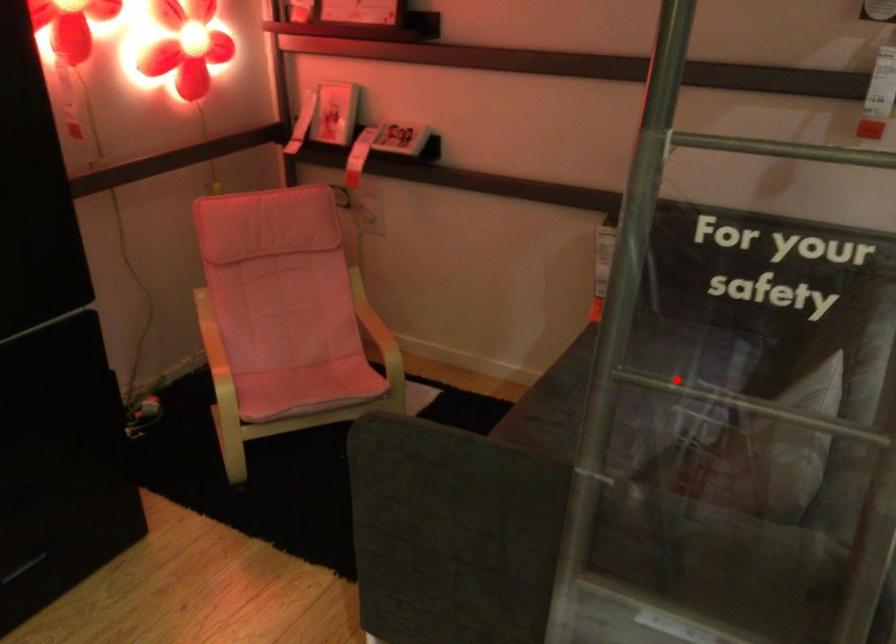
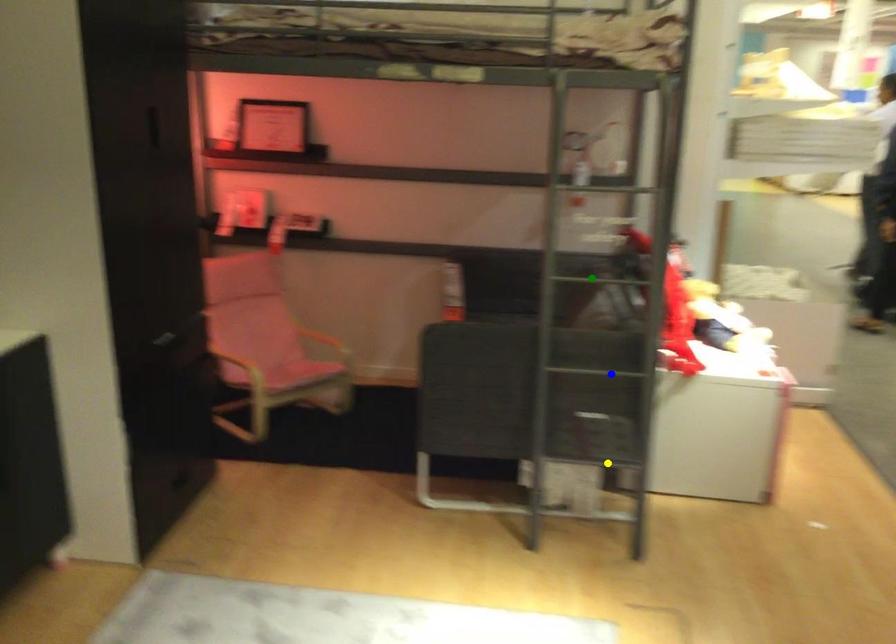
Question: I am providing you with two images of the same scene from different viewpoints. A red point is marked on the first image. You are given multiple points on the second image. Which point in image 2 is actually the same real-world point as the red point in image 1?

Choices:
 (A) yellow point
 (B) green point
 (C) blue point

Answer: (B)